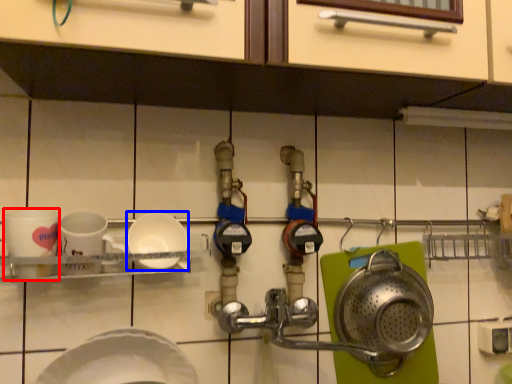
Question: Which object appears farthest to the camera in this image, coffee cup (highlighted by a red box) or plate (highlighted by a blue box)?

Choices:
 (A) coffee cup
 (B) plate

Answer: (B)